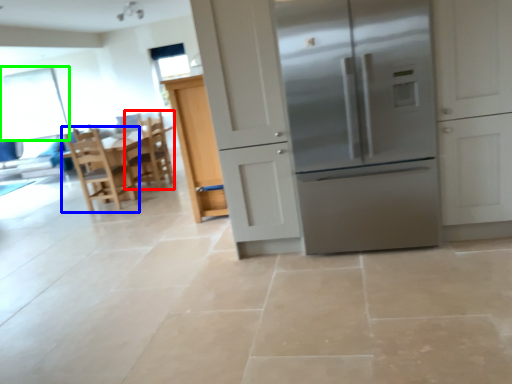
Question: Which object is the closest to the chair (highlighted by a red box)? Choose among these: chair (highlighted by a blue box) or window screen (highlighted by a green box).

Choices:
 (A) chair
 (B) window screen

Answer: (A)